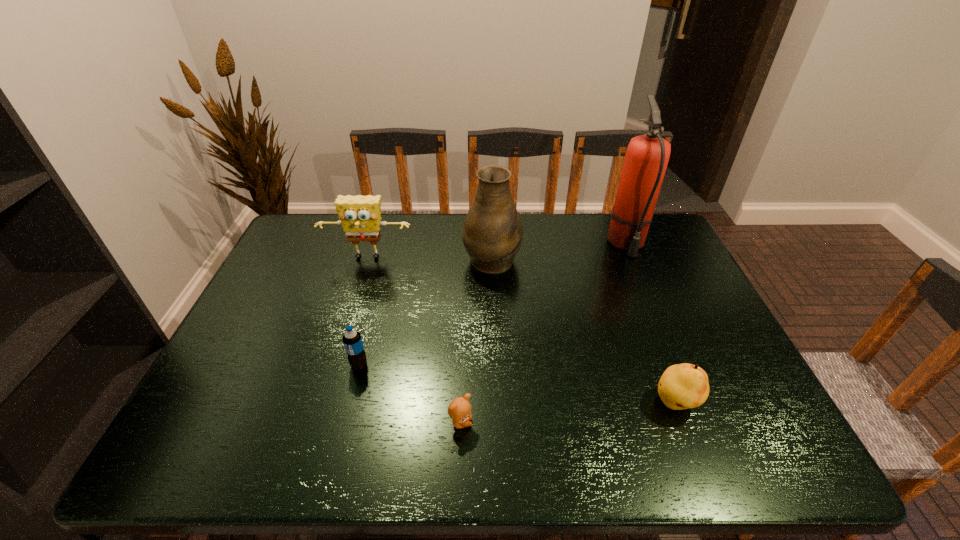
The image size is (960, 540). In order to click on vacant area situated on the front of the fourth farthest object in this screenshot , I will do `click(350, 401)`.

Where is `vacant space located on the front of the pear`? vacant space located on the front of the pear is located at coordinates (691, 443).

The height and width of the screenshot is (540, 960). Identify the location of blank area located on the face of the shortest object. pos(631,423).

This screenshot has width=960, height=540. Find the location of `fire extinguisher positioned at the far edge`. fire extinguisher positioned at the far edge is located at coordinates (646, 158).

At what (x,y) coordinates should I click in order to perform the action: click on pitcher that is at the far edge. Please return your answer as a coordinate pair (x, y). Image resolution: width=960 pixels, height=540 pixels. Looking at the image, I should click on (492, 235).

Find the location of `sponge that is at the far edge`. sponge that is at the far edge is located at coordinates (359, 215).

Locate an element on the screen. object that is at the near edge is located at coordinates (459, 410).

Where is `object located at the left edge`? The height and width of the screenshot is (540, 960). object located at the left edge is located at coordinates (359, 215).

Find the location of a particular element. This screenshot has height=540, width=960. fire extinguisher positioned at the right edge is located at coordinates (646, 158).

Locate an element on the screen. The height and width of the screenshot is (540, 960). pear that is positioned at the right edge is located at coordinates (x=682, y=386).